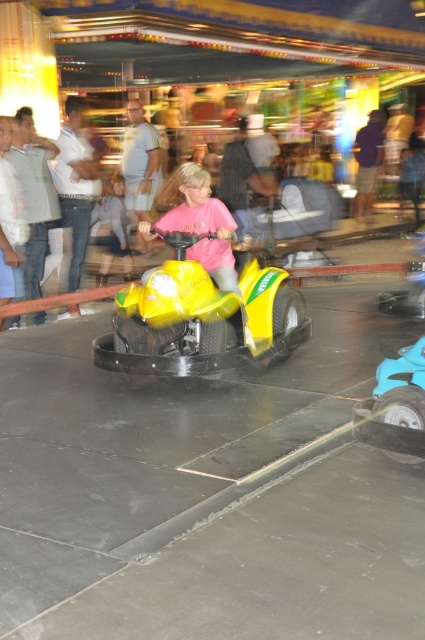
Question: Which object is closer to the camera taking this photo?

Choices:
 (A) blue rubber toy car at lower right
 (B) light blue denim jeans at center
 (C) yellow matte go-kart at center

Answer: (A)

Question: Is blue rubber toy car at lower right below light blue denim jeans at center?

Choices:
 (A) no
 (B) yes

Answer: (B)

Question: Is yellow matte go-kart at center positioned in front of blue rubber toy car at lower right?

Choices:
 (A) no
 (B) yes

Answer: (A)

Question: Is the position of yellow matte go-kart at center less distant than that of light blue denim jeans at center?

Choices:
 (A) yes
 (B) no

Answer: (A)

Question: Considering the real-world distances, which object is closest to the light blue denim jeans at center?

Choices:
 (A) yellow matte go-kart at center
 (B) blue rubber toy car at lower right

Answer: (A)

Question: Which point is closer to the camera?

Choices:
 (A) blue rubber toy car at lower right
 (B) light blue denim jeans at center

Answer: (A)